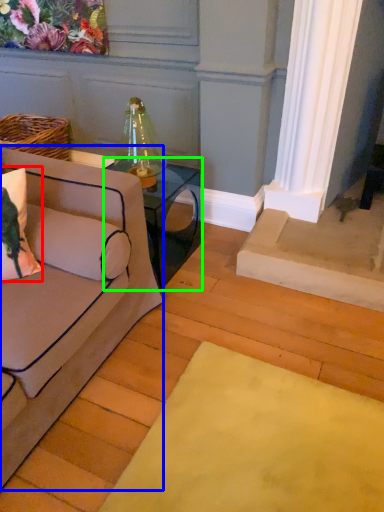
Question: Considering the real-world distances, which object is closest to pillow (highlighted by a red box)? studio couch (highlighted by a blue box) or table (highlighted by a green box).

Choices:
 (A) studio couch
 (B) table

Answer: (A)